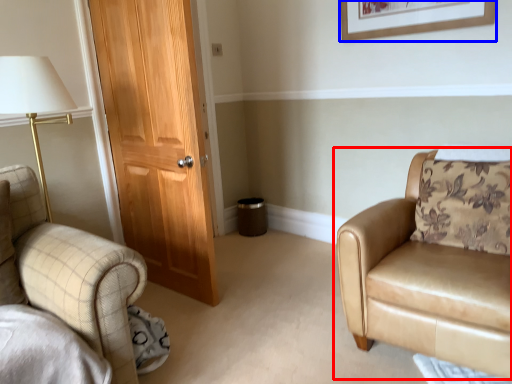
Question: Which object appears farthest to the camera in this image, chair (highlighted by a red box) or picture frame (highlighted by a blue box)?

Choices:
 (A) chair
 (B) picture frame

Answer: (B)